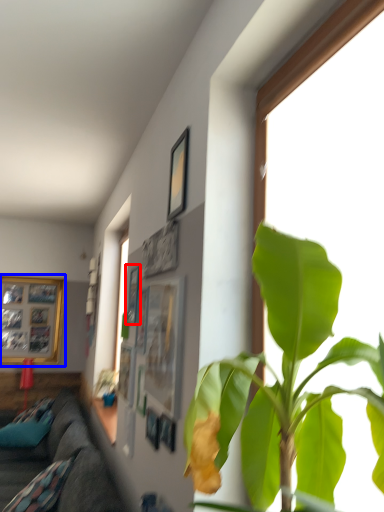
Question: Which of the following is the closest to the observer, picture frame (highlighted by a red box) or picture frame (highlighted by a blue box)?

Choices:
 (A) picture frame
 (B) picture frame

Answer: (A)